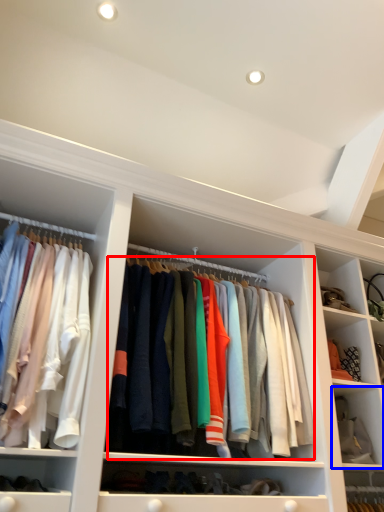
Question: Which object appears closest to the camera in this image, clothing (highlighted by a red box) or cabinet (highlighted by a blue box)?

Choices:
 (A) clothing
 (B) cabinet

Answer: (A)